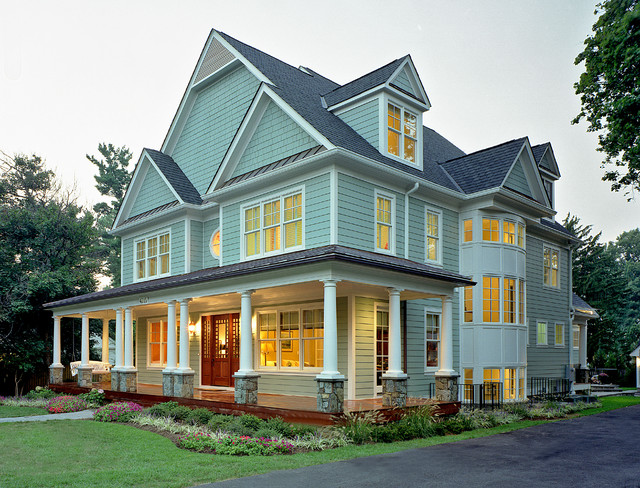
At what (x,y) coordinates should I click in order to perform the action: click on window blinds. Please return your answer as a coordinate pair (x, y). The height and width of the screenshot is (488, 640). Looking at the image, I should click on (308, 316), (294, 316), (379, 321), (431, 322).